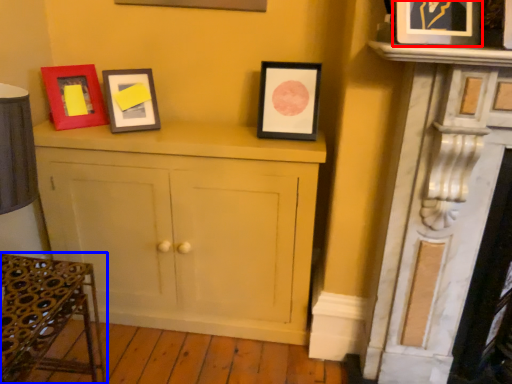
Question: Which object is closer to the camera taking this photo, picture frame (highlighted by a red box) or furniture (highlighted by a blue box)?

Choices:
 (A) picture frame
 (B) furniture

Answer: (B)